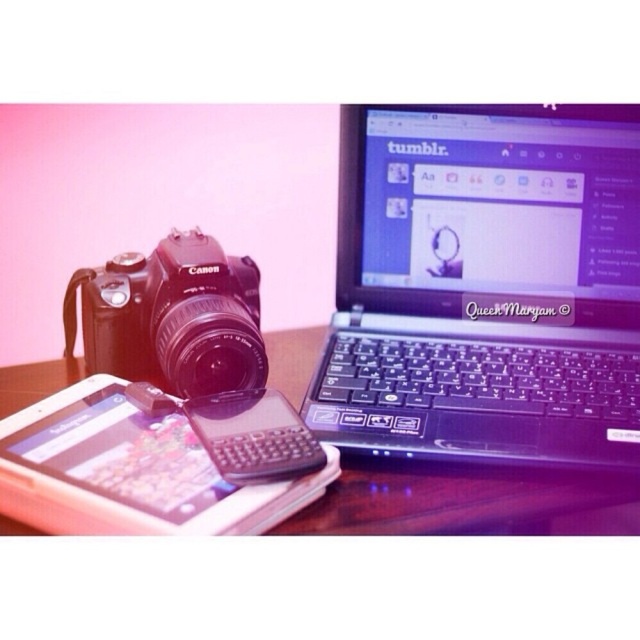
Question: Considering the relative positions of white plastic tablet at lower left and wooden table at center in the image provided, where is white plastic tablet at lower left located with respect to wooden table at center?

Choices:
 (A) left
 (B) right

Answer: (A)

Question: Does black plastic laptop at upper right have a larger size compared to wooden table at center?

Choices:
 (A) no
 (B) yes

Answer: (B)

Question: Observing the image, what is the correct spatial positioning of white plastic tablet at lower left in reference to wooden table at center?

Choices:
 (A) left
 (B) right

Answer: (A)

Question: Based on their relative distances, which object is farther from the wooden table at center?

Choices:
 (A) black plastic laptop at upper right
 (B) black plastic smartphone at center
 (C) white plastic tablet at lower left
 (D) black matte camera at left

Answer: (D)

Question: Among these objects, which one is nearest to the camera?

Choices:
 (A) black plastic smartphone at center
 (B) white plastic tablet at lower left
 (C) wooden table at center
 (D) black plastic laptop at upper right

Answer: (B)

Question: Which object is farther from the camera taking this photo?

Choices:
 (A) white plastic tablet at lower left
 (B) black plastic laptop at upper right
 (C) black matte camera at left
 (D) wooden table at center

Answer: (C)